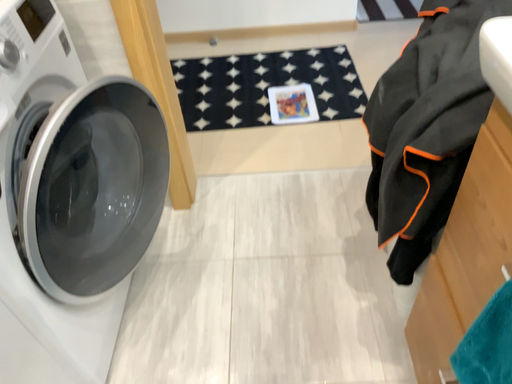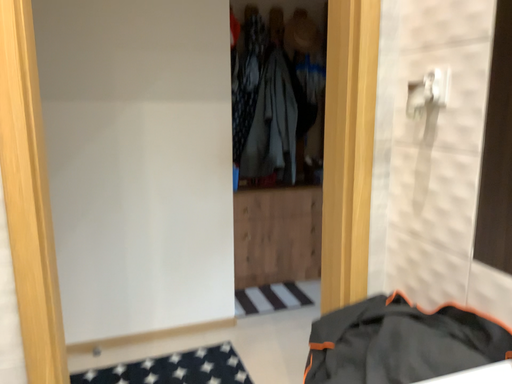
Question: Which way did the camera rotate in the video?

Choices:
 (A) rotated downward
 (B) rotated upward

Answer: (B)